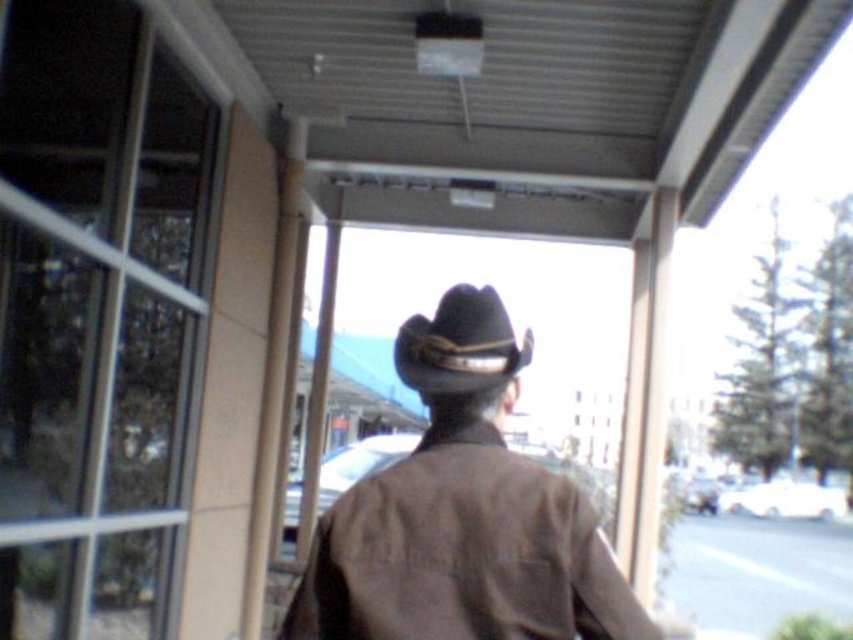
From the picture: Between brown leather cowboy hat at center and gray asphalt pavement at lower right, which one is positioned lower?

gray asphalt pavement at lower right

Can you confirm if brown leather cowboy hat at center is taller than gray asphalt pavement at lower right?

Indeed, brown leather cowboy hat at center has a greater height compared to gray asphalt pavement at lower right.

Which is behind, point (503, 500) or point (764, 588)?

The point (764, 588) is behind.

Identify the location of brown leather cowboy hat at center. The width and height of the screenshot is (853, 640). (463, 513).

Which is above, brown leather cowboy hat at center or black felt cowboy hat at center?

black felt cowboy hat at center

Is point (341, 625) more distant than point (431, 378)?

No, it is in front of (431, 378).

Identify the location of brown leather cowboy hat at center. Image resolution: width=853 pixels, height=640 pixels. (463, 513).

Which is in front, point (836, 602) or point (430, 396)?

Positioned in front is point (430, 396).

From the picture: Is gray asphalt pavement at lower right below black felt cowboy hat at center?

Yes.

Locate an element on the screen. The width and height of the screenshot is (853, 640). gray asphalt pavement at lower right is located at coordinates (757, 570).